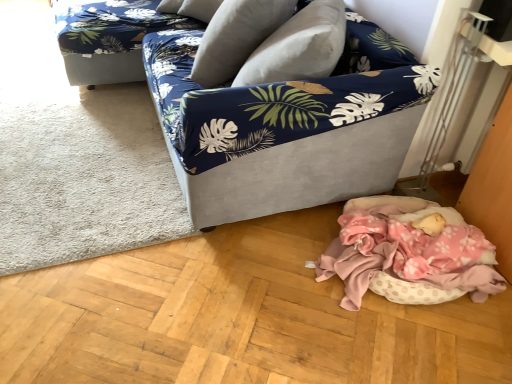
Question: Is velvet-like beige pillow at upper center in front of blue floral fabric couch at upper left?

Choices:
 (A) yes
 (B) no

Answer: (A)

Question: From the image's perspective, is velvet-like beige pillow at upper center on top of blue floral fabric couch at upper left?

Choices:
 (A) yes
 (B) no

Answer: (B)

Question: Is blue floral fabric couch at upper left a part of velvet-like beige pillow at upper center?

Choices:
 (A) yes
 (B) no

Answer: (B)

Question: Does velvet-like beige pillow at upper center turn towards blue floral fabric couch at upper left?

Choices:
 (A) no
 (B) yes

Answer: (A)

Question: Is velvet-like beige pillow at upper center at the left side of blue floral fabric couch at upper left?

Choices:
 (A) yes
 (B) no

Answer: (B)

Question: From the image's perspective, is velvet-like beige pillow at upper center under blue floral fabric couch at upper left?

Choices:
 (A) no
 (B) yes

Answer: (B)

Question: Does white soft rug at lower left have a lesser height compared to velvet fabric couch at center?

Choices:
 (A) yes
 (B) no

Answer: (A)

Question: Is the depth of white soft rug at lower left greater than that of velvet fabric couch at center?

Choices:
 (A) yes
 (B) no

Answer: (A)

Question: Is white soft rug at lower left thinner than velvet fabric couch at center?

Choices:
 (A) yes
 (B) no

Answer: (A)

Question: Considering the relative positions of white soft rug at lower left and velvet fabric couch at center in the image provided, is white soft rug at lower left in front of velvet fabric couch at center?

Choices:
 (A) yes
 (B) no

Answer: (B)

Question: Is white soft rug at lower left at the right side of velvet fabric couch at center?

Choices:
 (A) no
 (B) yes

Answer: (A)

Question: Is white soft rug at lower left next to velvet fabric couch at center and touching it?

Choices:
 (A) yes
 (B) no

Answer: (B)

Question: Does pink polka dot fabric at lower right have a larger size compared to white soft rug at lower left?

Choices:
 (A) yes
 (B) no

Answer: (B)